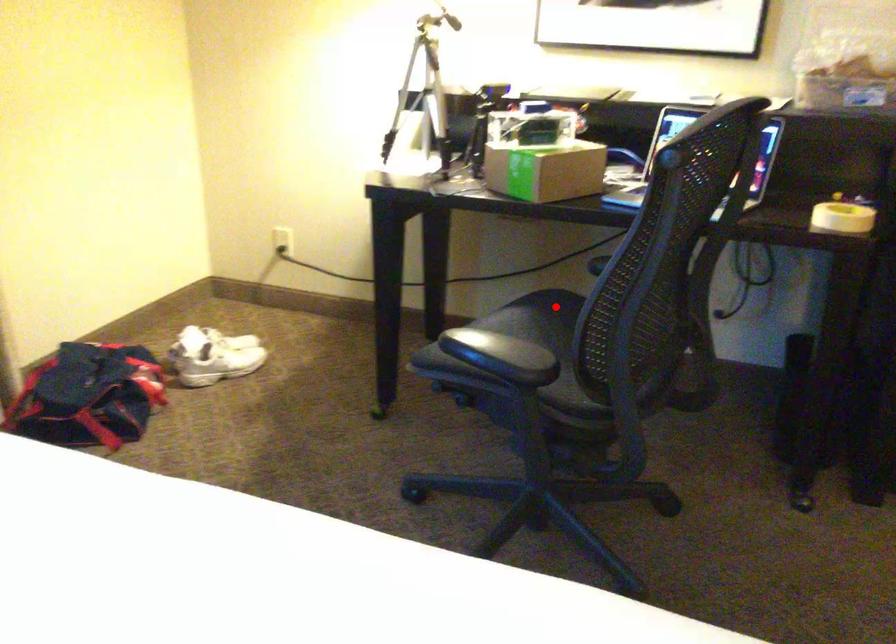
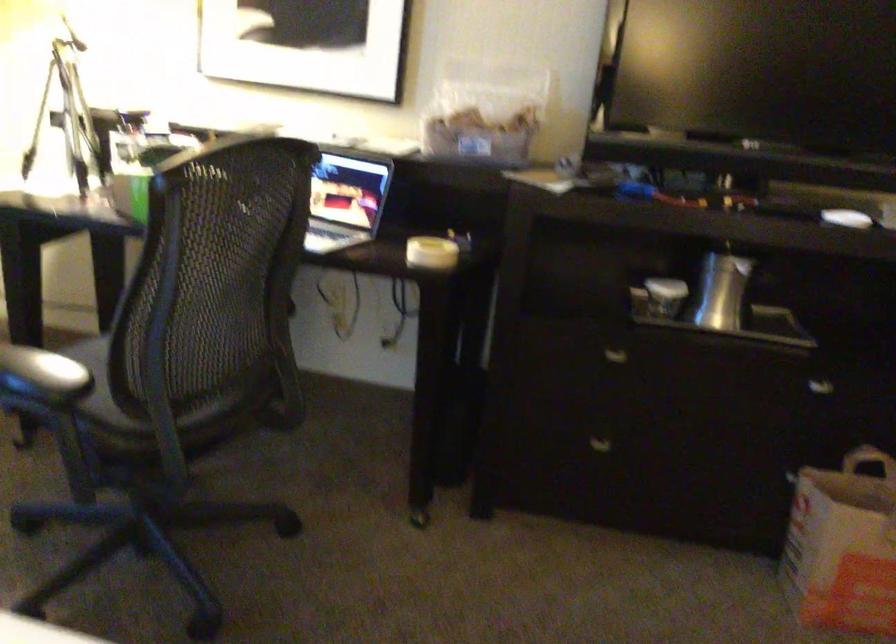
Question: I am providing you with two images of the same scene from different viewpoints. A red point is marked on the first image. Is the red point's position out of view in image 2?

Choices:
 (A) Yes
 (B) No

Answer: (A)